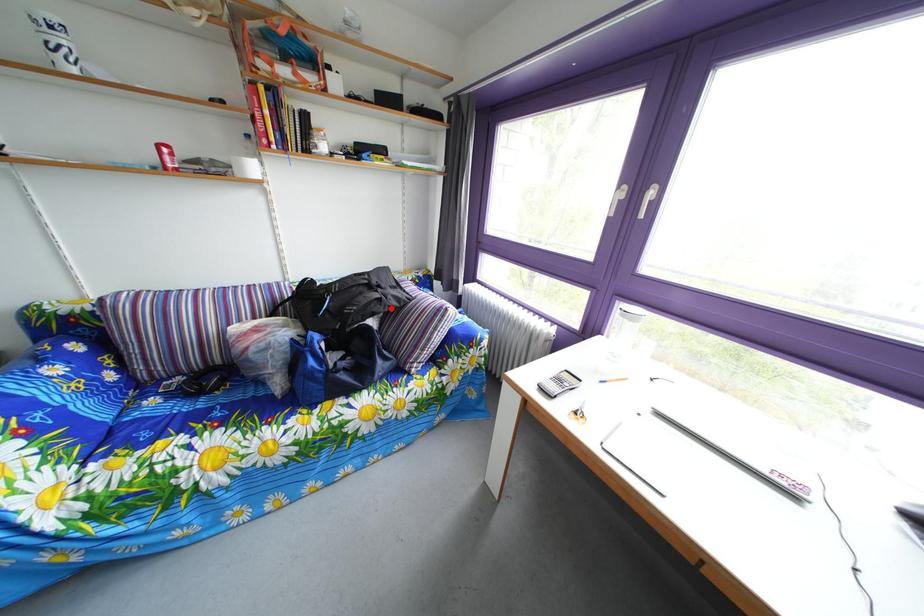
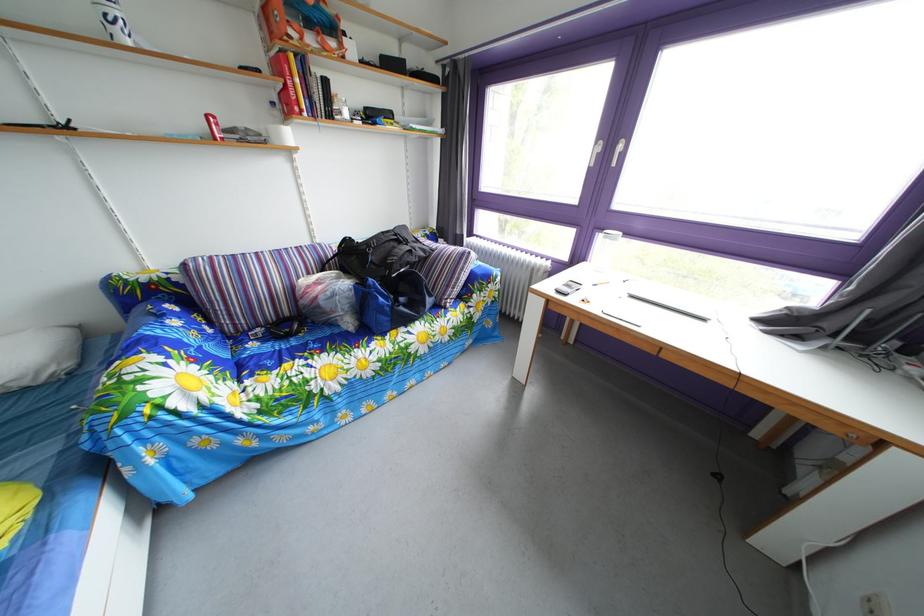
Locate, in the second image, the point that corresponds to the highlighted location in the first image.

(421, 260)